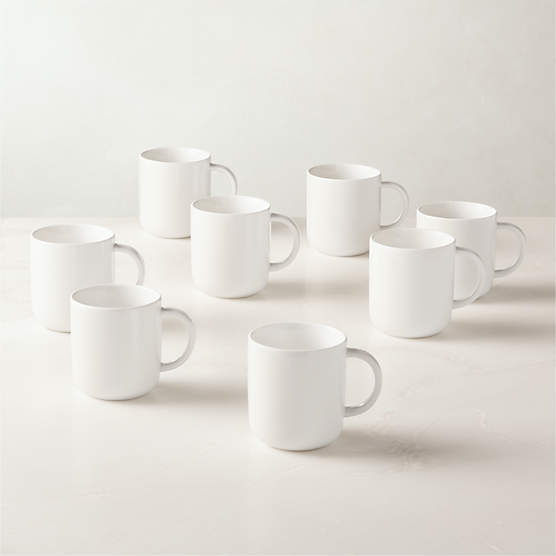
At what (x,y) coordinates should I click in order to perform the action: click on tea cups with handles pointed to the right. Please return your answer as a coordinate pair (x, y). Looking at the image, I should click on (104, 266), (119, 342), (226, 258), (178, 201), (332, 196), (398, 278), (478, 234), (299, 385).